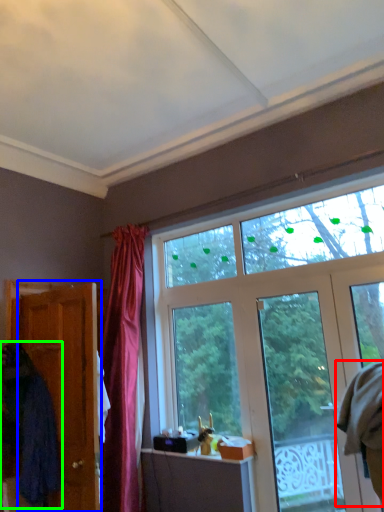
Question: Based on their relative distances, which object is nearer to robe (highlighted by a red box)? Choose from door (highlighted by a blue box) and robe (highlighted by a green box).

Choices:
 (A) door
 (B) robe

Answer: (A)